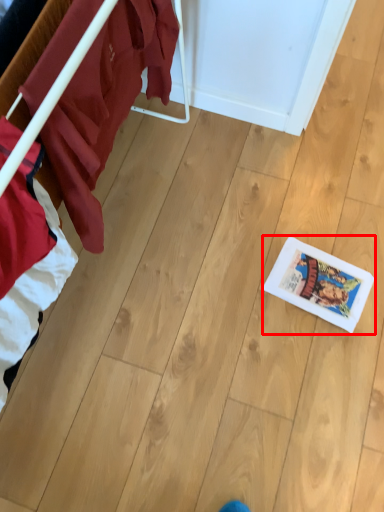
Question: From the image's perspective, considering the relative positions of comic book (annotated by the red box) and furniture in the image provided, where is comic book (annotated by the red box) located with respect to the staircase?

Choices:
 (A) below
 (B) above

Answer: (A)